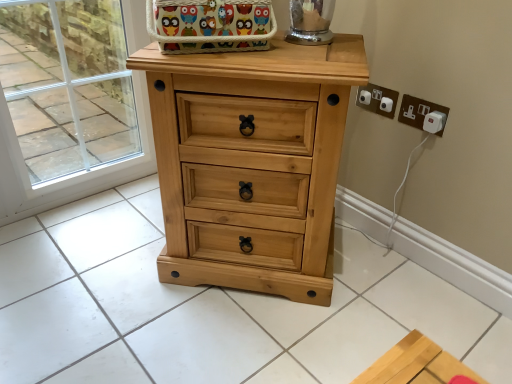
Question: Is light wood chest of drawers at center bigger than white plastic electrical outlet at upper right, placed as the second electric outlet when sorted from right to left?

Choices:
 (A) yes
 (B) no

Answer: (A)

Question: Does light wood chest of drawers at center have a lesser height compared to white plastic electrical outlet at upper right, placed as the second electric outlet when sorted from right to left?

Choices:
 (A) yes
 (B) no

Answer: (B)

Question: From the image's perspective, is light wood chest of drawers at center located beneath white plastic electrical outlet at upper right, which is the first electric outlet in left-to-right order?

Choices:
 (A) no
 (B) yes

Answer: (B)

Question: Is light wood chest of drawers at center wider than white plastic electrical outlet at upper right, placed as the second electric outlet when sorted from right to left?

Choices:
 (A) yes
 (B) no

Answer: (A)

Question: Is light wood chest of drawers at center not inside white plastic electrical outlet at upper right, placed as the second electric outlet when sorted from right to left?

Choices:
 (A) yes
 (B) no

Answer: (A)

Question: Can you confirm if light wood chest of drawers at center is thinner than white plastic electrical outlet at upper right, placed as the second electric outlet when sorted from right to left?

Choices:
 (A) no
 (B) yes

Answer: (A)

Question: Can you see white plastic plug at upper right, which appears as the 1th electric outlet when viewed from the right, touching light wood chest of drawers at center?

Choices:
 (A) no
 (B) yes

Answer: (A)

Question: From the image's perspective, is white plastic plug at upper right, which appears as the 1th electric outlet when viewed from the right, under light wood chest of drawers at center?

Choices:
 (A) yes
 (B) no

Answer: (B)

Question: Is white plastic plug at upper right, which appears as the 1th electric outlet when viewed from the right, in front of light wood chest of drawers at center?

Choices:
 (A) yes
 (B) no

Answer: (B)

Question: Does white plastic plug at upper right, positioned as the 2th electric outlet in left-to-right order, appear on the right side of light wood chest of drawers at center?

Choices:
 (A) yes
 (B) no

Answer: (A)

Question: Does white plastic plug at upper right, positioned as the 2th electric outlet in left-to-right order, have a greater width compared to light wood chest of drawers at center?

Choices:
 (A) yes
 (B) no

Answer: (B)

Question: Can you confirm if white plastic plug at upper right, positioned as the 2th electric outlet in left-to-right order, is bigger than light wood chest of drawers at center?

Choices:
 (A) no
 (B) yes

Answer: (A)

Question: From a real-world perspective, is white plastic electrical outlet at upper right, which is the first electric outlet in left-to-right order, positioned over transparent glass door at upper left based on gravity?

Choices:
 (A) yes
 (B) no

Answer: (A)